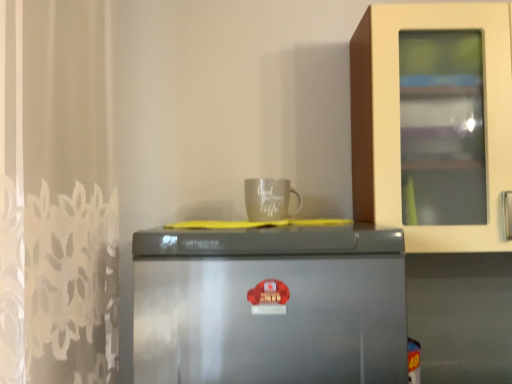
Find the location of a particular element. gray matte mug at upper center is located at coordinates (269, 199).

The width and height of the screenshot is (512, 384). What do you see at coordinates (269, 199) in the screenshot?
I see `gray matte mug at upper center` at bounding box center [269, 199].

Describe the element at coordinates (276, 305) in the screenshot. I see `satin silver fridge at center` at that location.

Measure the distance between satin silver fridge at center and camera.

The depth of satin silver fridge at center is 34.71 inches.

Identify the location of satin silver fridge at center. This screenshot has width=512, height=384. (276, 305).

From the picture: What is the approximate width of satin silver fridge at center?

The width of satin silver fridge at center is 25.48 inches.

Where is `gray matte mug at upper center`? Image resolution: width=512 pixels, height=384 pixels. gray matte mug at upper center is located at coordinates (269, 199).

Which is more to the left, gray matte mug at upper center or satin silver fridge at center?

Positioned to the left is satin silver fridge at center.

Is gray matte mug at upper center closer to camera compared to satin silver fridge at center?

No, gray matte mug at upper center is further to the viewer.

Is point (279, 204) closer or farther from the camera than point (263, 363)?

Point (279, 204).

From the image's perspective, is gray matte mug at upper center located beneath satin silver fridge at center?

No.

From a real-world perspective, is gray matte mug at upper center located higher than satin silver fridge at center?

Correct, in the physical world, gray matte mug at upper center is higher than satin silver fridge at center.

Looking at this image, which object is thinner, gray matte mug at upper center or satin silver fridge at center?

Thinner between the two is gray matte mug at upper center.

From the picture: Considering the relative sizes of gray matte mug at upper center and satin silver fridge at center in the image provided, is gray matte mug at upper center taller than satin silver fridge at center?

In fact, gray matte mug at upper center may be shorter than satin silver fridge at center.

Does gray matte mug at upper center have a larger size compared to satin silver fridge at center?

No.

Is gray matte mug at upper center not within satin silver fridge at center?

gray matte mug at upper center is positioned outside satin silver fridge at center.

Is gray matte mug at upper center next to satin silver fridge at center and touching it?

gray matte mug at upper center and satin silver fridge at center are clearly separated.

Is gray matte mug at upper center oriented towards satin silver fridge at center?

No, gray matte mug at upper center does not turn towards satin silver fridge at center.

This screenshot has height=384, width=512. What are the coordinates of `refrigerator below the gray matte mug at upper center (from the image's perspective)` in the screenshot? It's located at (276, 305).

Does satin silver fridge at center appear on the left side of gray matte mug at upper center?

Yes, satin silver fridge at center is to the left of gray matte mug at upper center.

Considering the positions of objects satin silver fridge at center and gray matte mug at upper center in the image provided, who is behind, satin silver fridge at center or gray matte mug at upper center?

gray matte mug at upper center is behind.

Which point is more distant from viewer, (357,227) or (268,189)?

Point (357,227)

From the image's perspective, is satin silver fridge at center above or below gray matte mug at upper center?

satin silver fridge at center is situated lower than gray matte mug at upper center in the image.

From a real-world perspective, is satin silver fridge at center under gray matte mug at upper center?

Yes, from a real-world perspective, satin silver fridge at center is under gray matte mug at upper center.

Between satin silver fridge at center and gray matte mug at upper center, which one has larger width?

satin silver fridge at center.

Consider the image. Who is taller, satin silver fridge at center or gray matte mug at upper center?

Standing taller between the two is satin silver fridge at center.

Can you confirm if satin silver fridge at center is bigger than gray matte mug at upper center?

Correct, satin silver fridge at center is larger in size than gray matte mug at upper center.

Would you say satin silver fridge at center is inside or outside gray matte mug at upper center?

satin silver fridge at center exists outside the volume of gray matte mug at upper center.

Is satin silver fridge at center positioned far away from gray matte mug at upper center?

No, there isn't a large distance between satin silver fridge at center and gray matte mug at upper center.

Is satin silver fridge at center positioned with its back to gray matte mug at upper center?

No, satin silver fridge at center is not facing the opposite direction of gray matte mug at upper center.

What's the angular difference between satin silver fridge at center and gray matte mug at upper center's facing directions?

satin silver fridge at center and gray matte mug at upper center are facing 1.92 degrees away from each other.

Measure the distance between satin silver fridge at center and gray matte mug at upper center.

satin silver fridge at center is 38.91 centimeters from gray matte mug at upper center.

Find the location of a particular element. This screenshot has width=512, height=384. refrigerator lying below the gray matte mug at upper center (from the image's perspective) is located at coordinates (276, 305).

Find the location of `refrigerator located on the left of gray matte mug at upper center`. refrigerator located on the left of gray matte mug at upper center is located at coordinates (276, 305).

Locate an element on the screen. refrigerator below the gray matte mug at upper center (from the image's perspective) is located at coordinates click(276, 305).